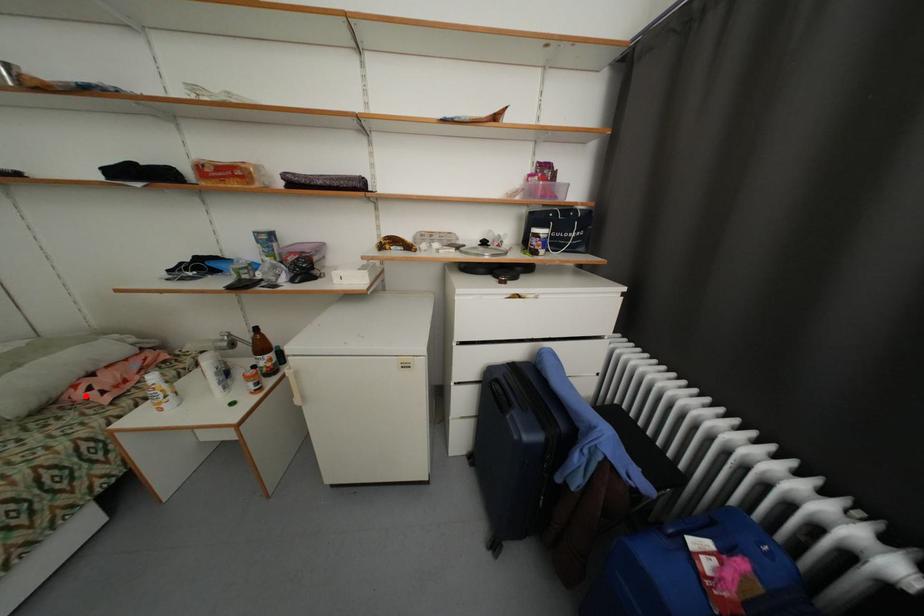
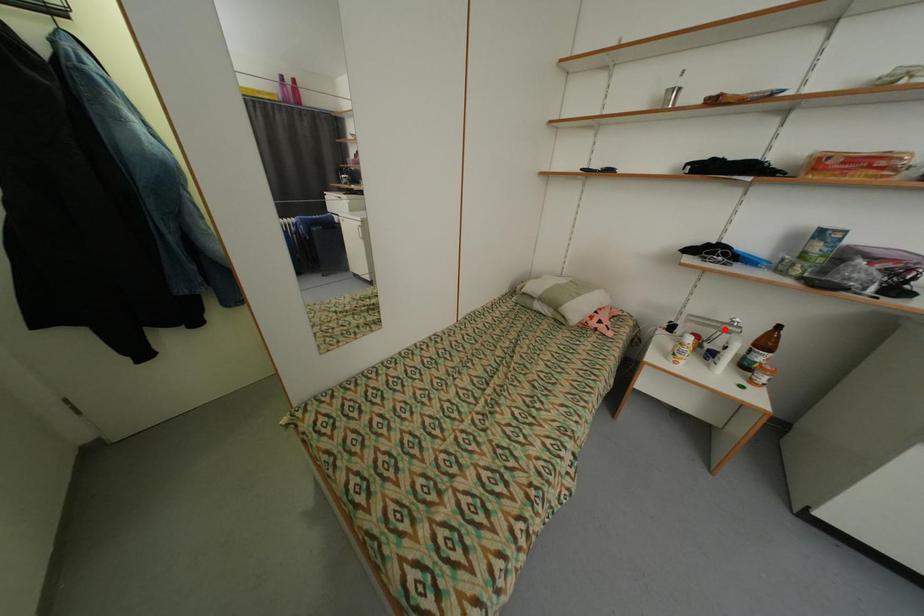
I am providing you with two images of the same scene from different viewpoints. A red point is marked on the first image and another point is marked on the second image. Does the point marked in image1 correspond to the same location as the one in image2?

No